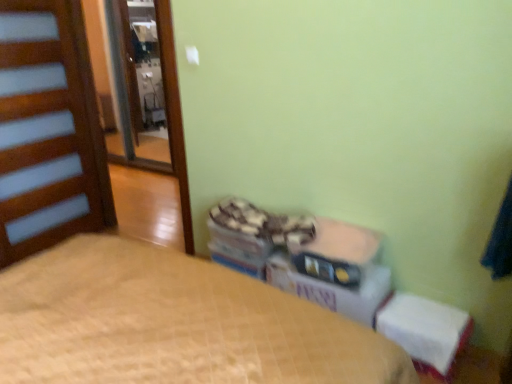
Question: Is white fabric changing table at lower right aimed at white cardboard box at center?

Choices:
 (A) yes
 (B) no

Answer: (B)

Question: Does white fabric changing table at lower right lie behind white cardboard box at center?

Choices:
 (A) no
 (B) yes

Answer: (A)

Question: Is white fabric changing table at lower right to the right of white cardboard box at center from the viewer's perspective?

Choices:
 (A) no
 (B) yes

Answer: (B)

Question: Does white fabric changing table at lower right have a lesser width compared to white cardboard box at center?

Choices:
 (A) no
 (B) yes

Answer: (B)

Question: Could white cardboard box at center be considered to be inside white fabric changing table at lower right?

Choices:
 (A) no
 (B) yes

Answer: (A)

Question: Are white fabric changing table at lower right and white cardboard box at center located far from each other?

Choices:
 (A) yes
 (B) no

Answer: (B)

Question: Is the depth of white cardboard box at center greater than that of white fabric changing table at lower right?

Choices:
 (A) no
 (B) yes

Answer: (B)

Question: Is white cardboard box at center next to white fabric changing table at lower right and touching it?

Choices:
 (A) no
 (B) yes

Answer: (A)

Question: Is white cardboard box at center positioned beyond the bounds of white fabric changing table at lower right?

Choices:
 (A) no
 (B) yes

Answer: (B)

Question: Could you tell me if white cardboard box at center is facing white fabric changing table at lower right?

Choices:
 (A) no
 (B) yes

Answer: (A)

Question: Is white fabric changing table at lower right completely or partially inside white cardboard box at center?

Choices:
 (A) no
 (B) yes

Answer: (A)

Question: Is white cardboard box at center positioned before white fabric changing table at lower right?

Choices:
 (A) no
 (B) yes

Answer: (A)

Question: Is matte plastic storage box at center not within white cardboard box at center?

Choices:
 (A) no
 (B) yes

Answer: (B)